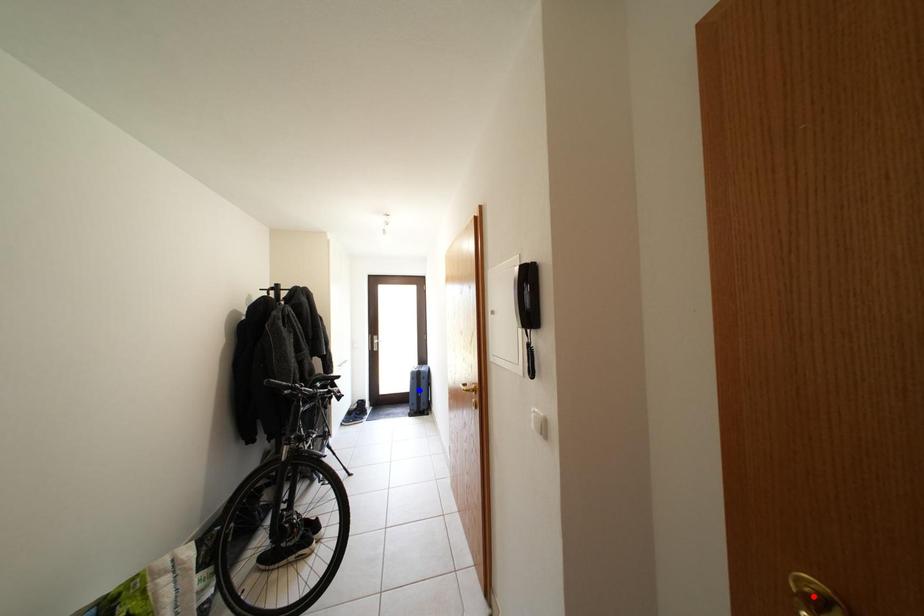
Question: Which of the two points in the image is closer to the camera?

Choices:
 (A) Blue point is closer.
 (B) Red point is closer.

Answer: (B)